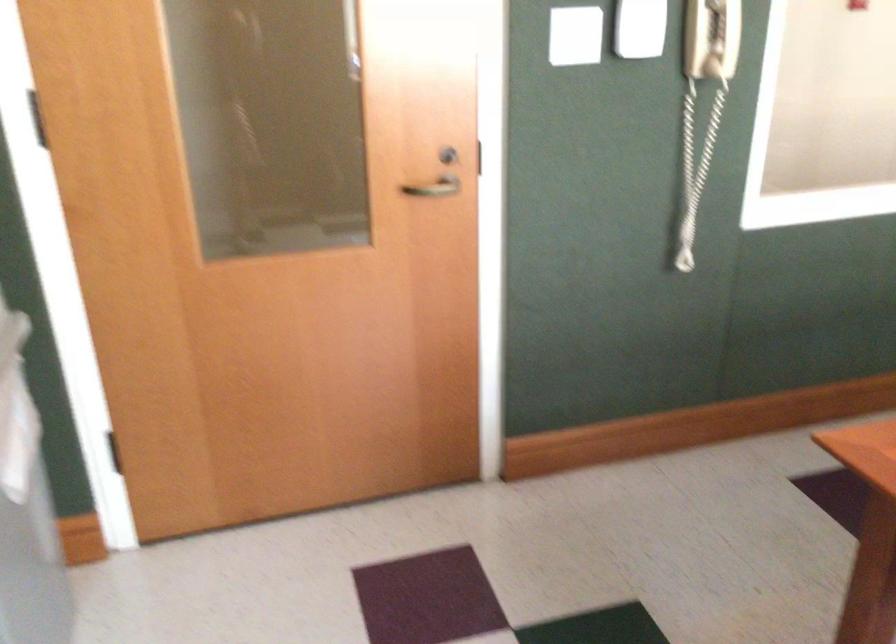
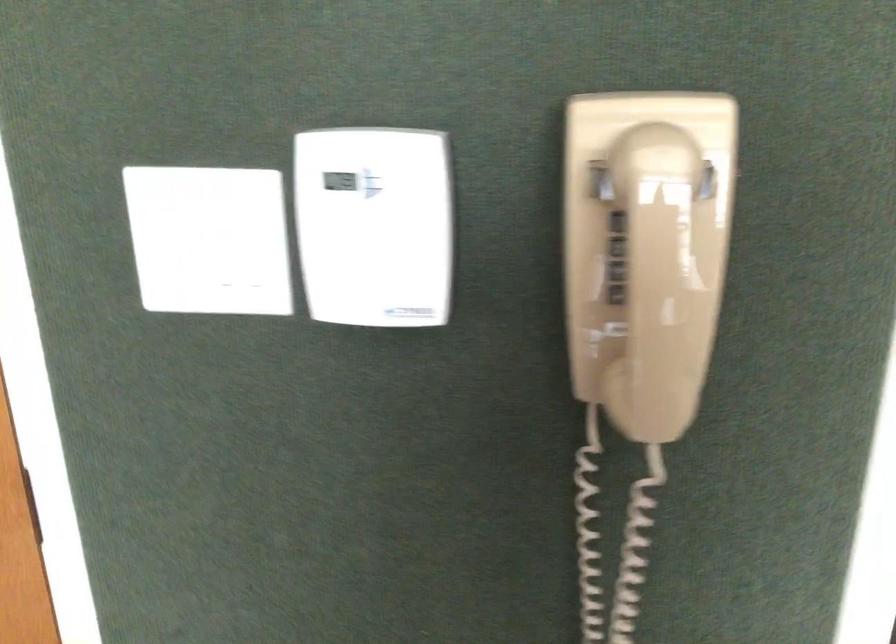
The images are taken continuously from a first-person perspective. In which direction are you moving?

The cameraman walked toward right, forward.